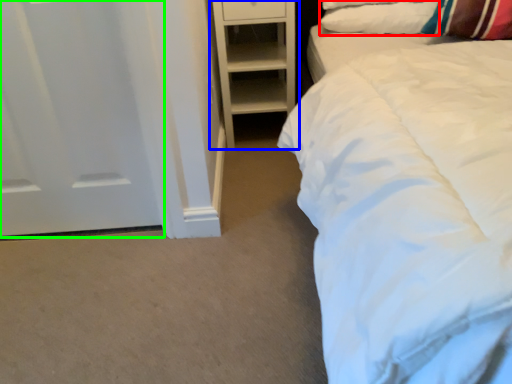
Question: Estimate the real-world distances between objects in this image. Which object is closer to pillow (highlighted by a red box), shelf (highlighted by a blue box) or door (highlighted by a green box)?

Choices:
 (A) shelf
 (B) door

Answer: (A)